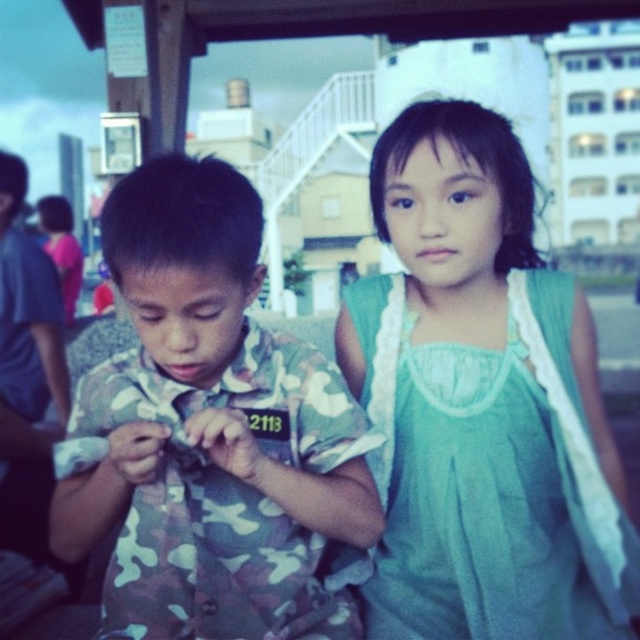
What do you see at coordinates (481, 403) in the screenshot? I see `green sheer dress at center` at bounding box center [481, 403].

Is point (401, 384) in front of point (104, 621)?

No, it is not.

Where is `green sheer dress at center`? green sheer dress at center is located at coordinates (481, 403).